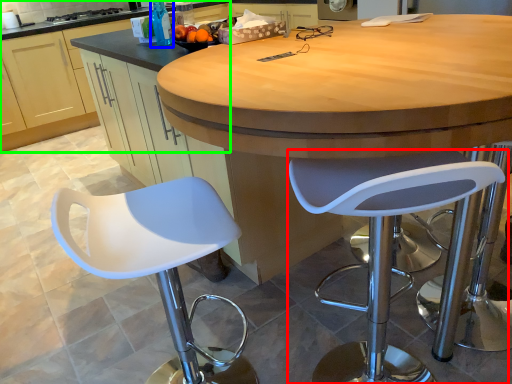
Question: Which object is positioned farthest from chair (highlighted by a red box)? Select from bottle (highlighted by a blue box) and cabinetry (highlighted by a green box).

Choices:
 (A) bottle
 (B) cabinetry

Answer: (B)